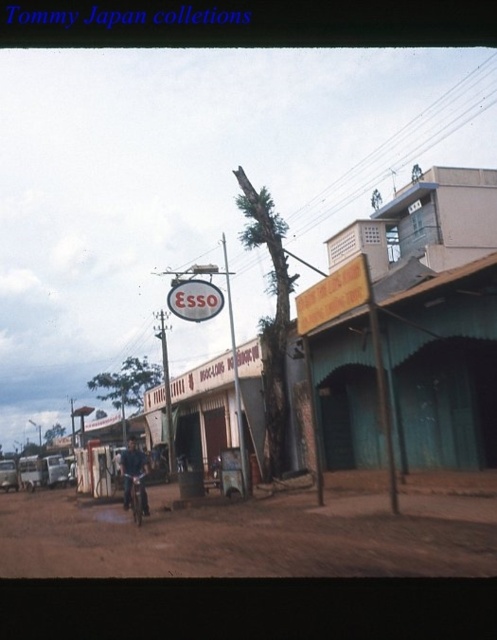
You are a delivery person trying to navigate through the town. You see the matte gray building at center and the brown dirt track at center. Which one is higher in elevation?

The matte gray building at center is taller than the brown dirt track at center, so the matte gray building at center is higher in elevation.

You are a delivery driver who needs to turn onto the dirt track from the road. Based on the scene, which object is closer to you, the matte gray building at center or the brown dirt track at center?

The matte gray building at center is closer to you because the brown dirt track at center is positioned behind it.